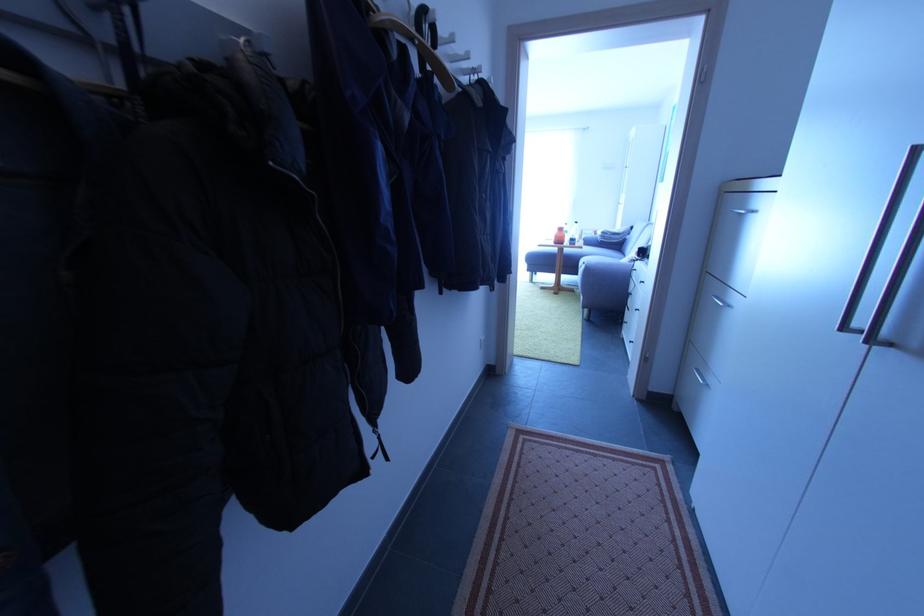
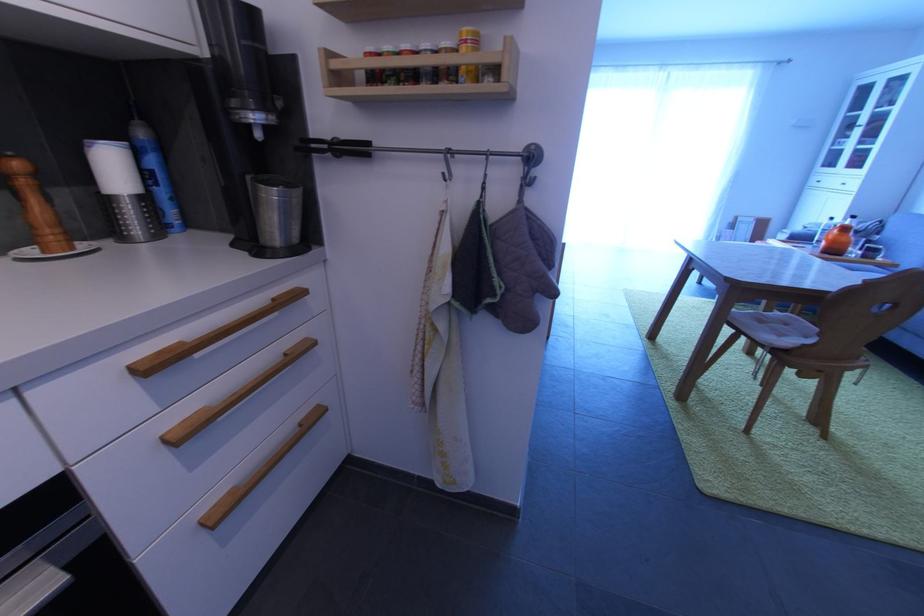
Which direction would the cameraman need to move to produce the second image?

The cameraman moved toward left, forward.